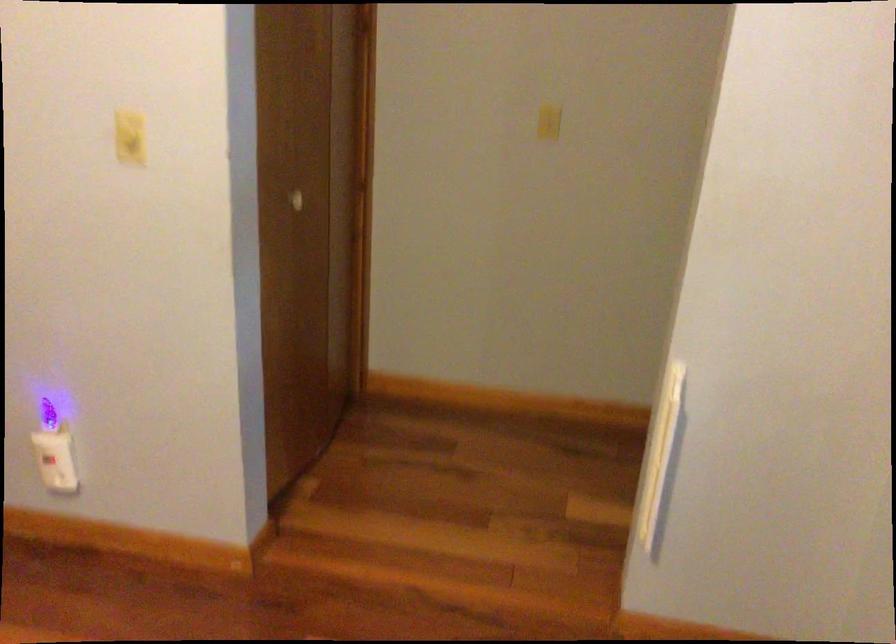
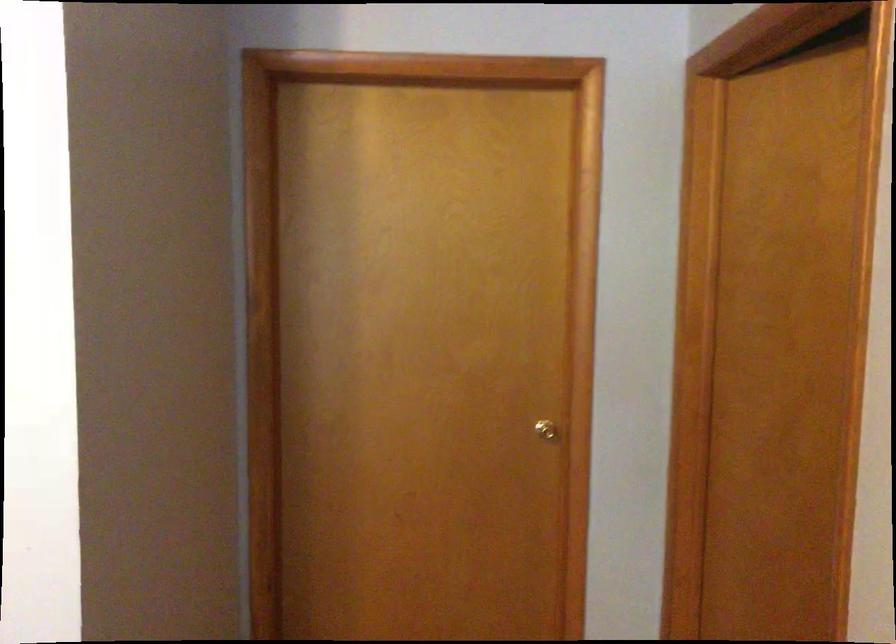
Question: The first image is from the beginning of the video and the second image is from the end. How did the camera likely rotate when shooting the video?

Choices:
 (A) Left
 (B) Right
 (C) Up
 (D) Down

Answer: (A)